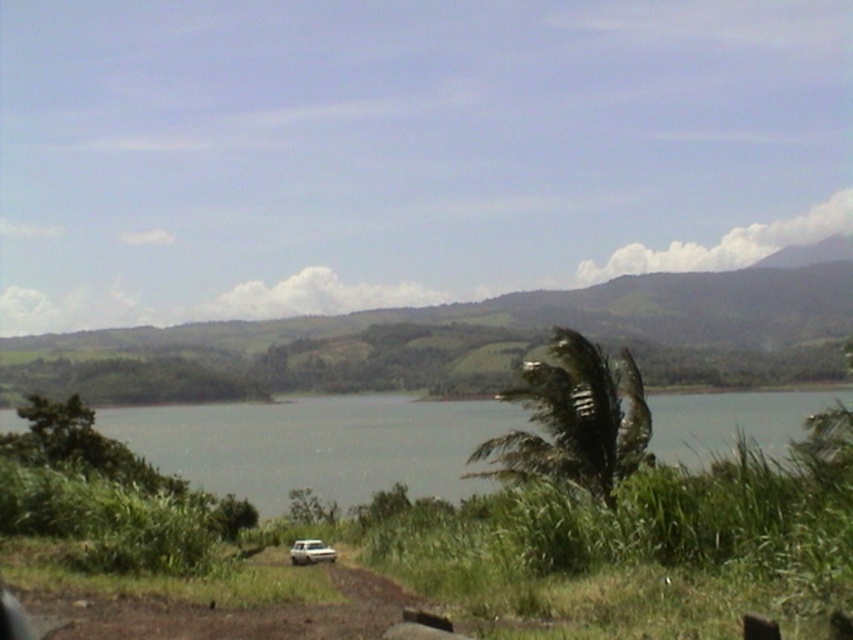
Question: Does green grassy hill at center have a smaller size compared to green leafy palm at center?

Choices:
 (A) no
 (B) yes

Answer: (A)

Question: Which point is farther from the camera taking this photo?

Choices:
 (A) (306, 538)
 (B) (631, 360)
 (C) (300, 385)
 (D) (61, 586)

Answer: (C)

Question: Is gray water at center to the left of white matte car at lower center from the viewer's perspective?

Choices:
 (A) no
 (B) yes

Answer: (A)

Question: Which point is farther from the camera taking this photo?

Choices:
 (A) (339, 497)
 (B) (318, 579)
 (C) (485, 352)
 (D) (614, 456)

Answer: (C)

Question: Which point appears closest to the camera in this image?

Choices:
 (A) (55, 589)
 (B) (259, 490)
 (C) (282, 376)

Answer: (A)

Question: Is gray water at center smaller than green leafy palm at center?

Choices:
 (A) yes
 (B) no

Answer: (B)